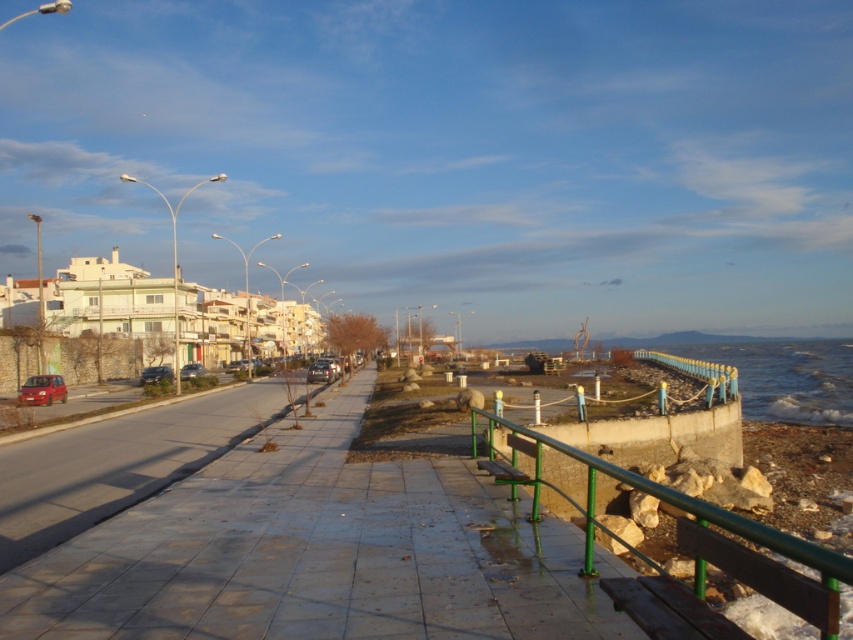
Question: Which object is positioned farthest from the matte red hatchback at lower left?

Choices:
 (A) smooth concrete pavement at center
 (B) metallic silver car at center-left
 (C) blue glass water at lower right

Answer: (C)

Question: Does matte red hatchback at lower left come in front of matte black car at lower left?

Choices:
 (A) yes
 (B) no

Answer: (A)

Question: Is matte black car at lower left behind metallic silver car at center-left?

Choices:
 (A) yes
 (B) no

Answer: (B)

Question: Does blue glass water at lower right appear on the right side of metallic silver car at center-left?

Choices:
 (A) no
 (B) yes

Answer: (B)

Question: Which object is closer to the camera taking this photo?

Choices:
 (A) metallic silver car at center
 (B) matte red hatchback at lower left
 (C) matte black car at lower left

Answer: (B)

Question: Based on their relative distances, which object is farther from the smooth concrete pavement at center?

Choices:
 (A) matte red hatchback at lower left
 (B) green metallic railing at lower right

Answer: (A)